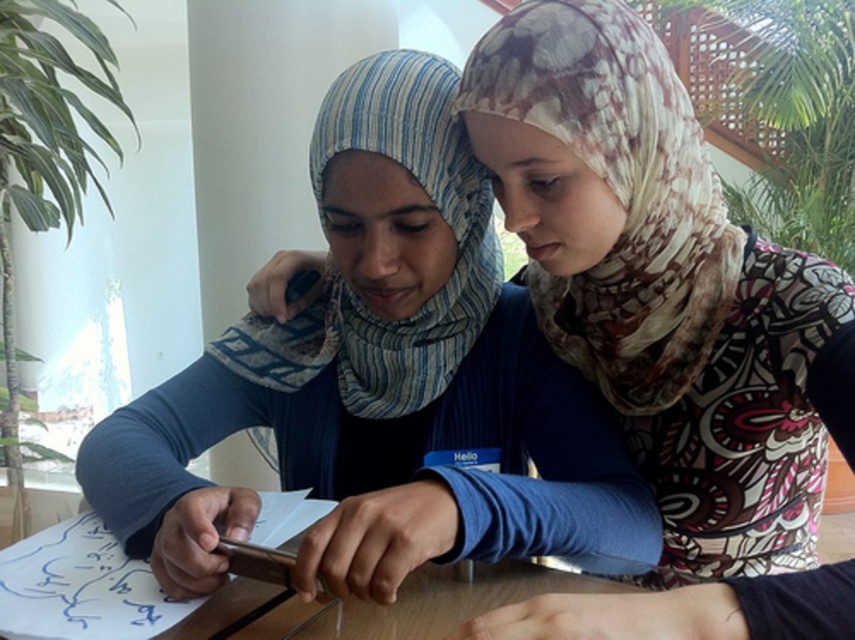
You are a photographer setting up for a portrait session. You need to ensure that the blue fabric shirt at center and the printed silk scarf at upper right are both in focus. The depth of field in your camera can cover objects within a 6 inch range. Will both items be in focus?

The blue fabric shirt at center is 6.87 inches from the printed silk scarf at upper right. Since the distance between them exceeds the 6 inch depth of field range, not both items will be in focus simultaneously.

You are an interior designer arranging items on a shelf. You have a printed silk scarf at upper right and a blue striped scarf at center. Which scarf is placed above the other?

The printed silk scarf at upper right is positioned over the blue striped scarf at center, meaning it is placed above the other.

You are an observer looking at the two people at the table. Which item, the blue fabric shirt at center or the blue striped scarf at center, is taller?

The blue fabric shirt at center is taller than the blue striped scarf at center.